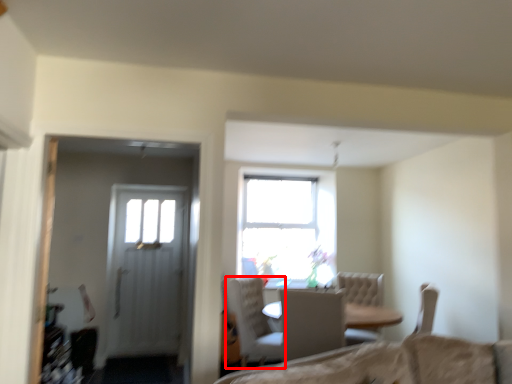
Question: In this image, where is chair (annotated by the red box) located relative to chair?

Choices:
 (A) left
 (B) right

Answer: (A)